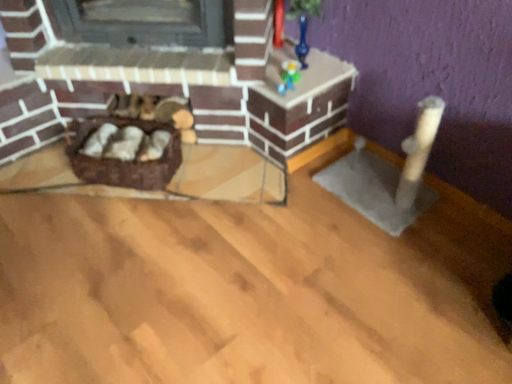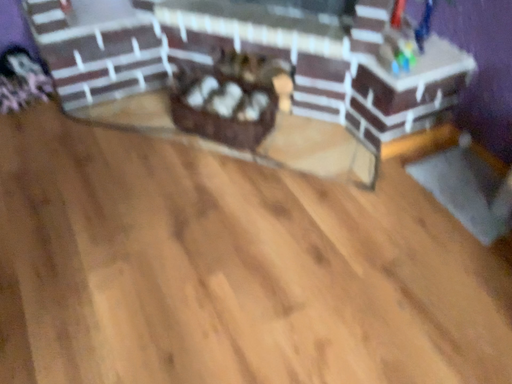
Question: Which way did the camera rotate in the video?

Choices:
 (A) rotated right
 (B) rotated left

Answer: (B)